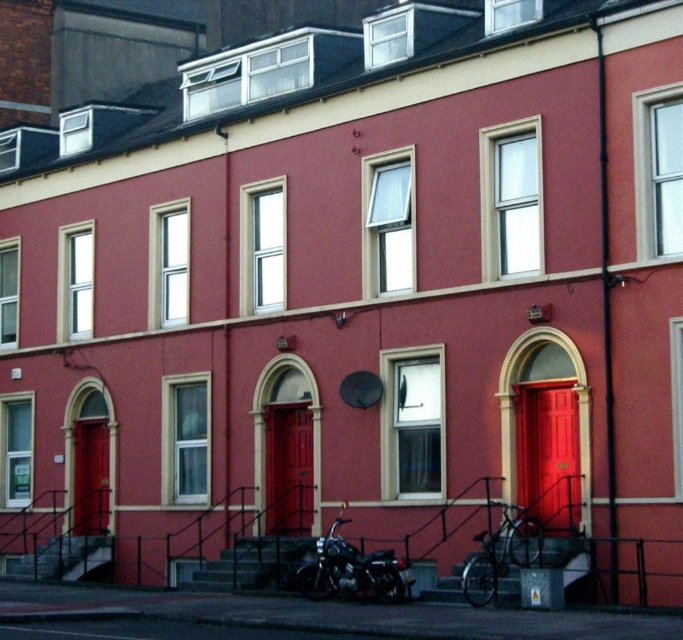
Does matte red door at center right have a smaller size compared to matte red door at lower left?

No, matte red door at center right is not smaller than matte red door at lower left.

Between matte red door at center right and matte red door at lower left, which one has less height?

Standing shorter between the two is matte red door at center right.

What do you see at coordinates (548, 454) in the screenshot? The height and width of the screenshot is (640, 683). I see `matte red door at center right` at bounding box center [548, 454].

This screenshot has width=683, height=640. What are the coordinates of `matte red door at center right` in the screenshot? It's located at (548, 454).

Describe the element at coordinates (288, 468) in the screenshot. Image resolution: width=683 pixels, height=640 pixels. I see `matte red door at center` at that location.

Who is positioned more to the right, matte red door at center or matte red door at lower left?

matte red door at center

Which is behind, point (270, 470) or point (107, 426)?

Positioned behind is point (107, 426).

This screenshot has height=640, width=683. Identify the location of matte red door at center. (288, 468).

Which is in front, point (566, 412) or point (303, 588)?

Positioned in front is point (566, 412).

Is point (557, 477) farther from camera compared to point (406, 570)?

Yes, point (557, 477) is farther from viewer.

Where is `matte red door at center right`? matte red door at center right is located at coordinates (548, 454).